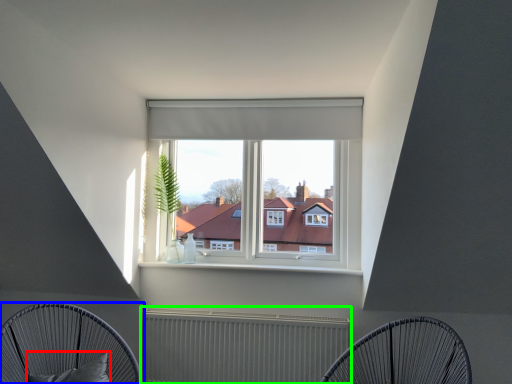
Question: Which object is the closest to the pillow (highlighted by a red box)? Choose among these: furniture (highlighted by a blue box) or radiator (highlighted by a green box).

Choices:
 (A) furniture
 (B) radiator

Answer: (A)